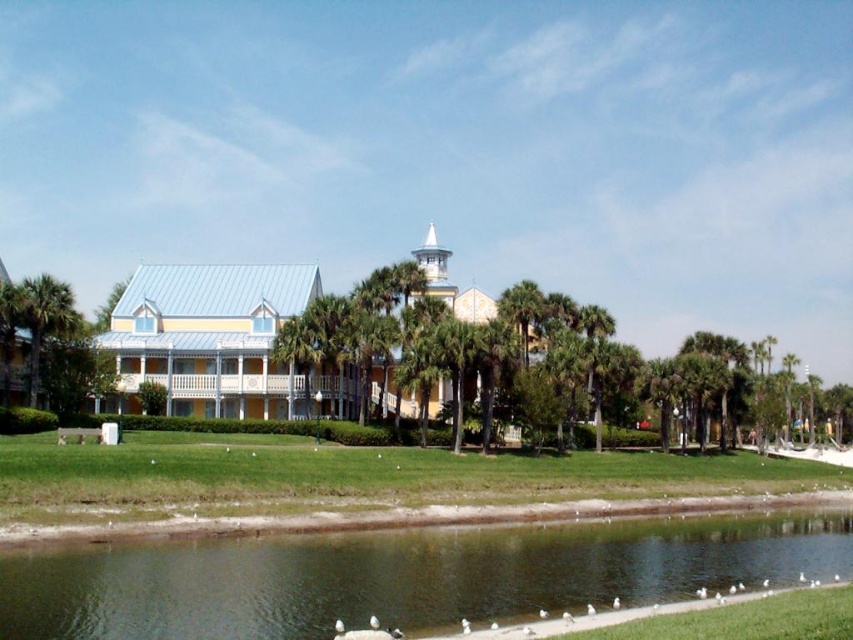
You are standing in front of the building and want to walk towards the green leafy palm tree at left. Which direction should you move relative to the green grassy bank at lower center?

The green grassy bank at lower center is smaller than the green leafy palm tree at left, so you should move to the left of the green grassy bank at lower center to reach the palm tree.